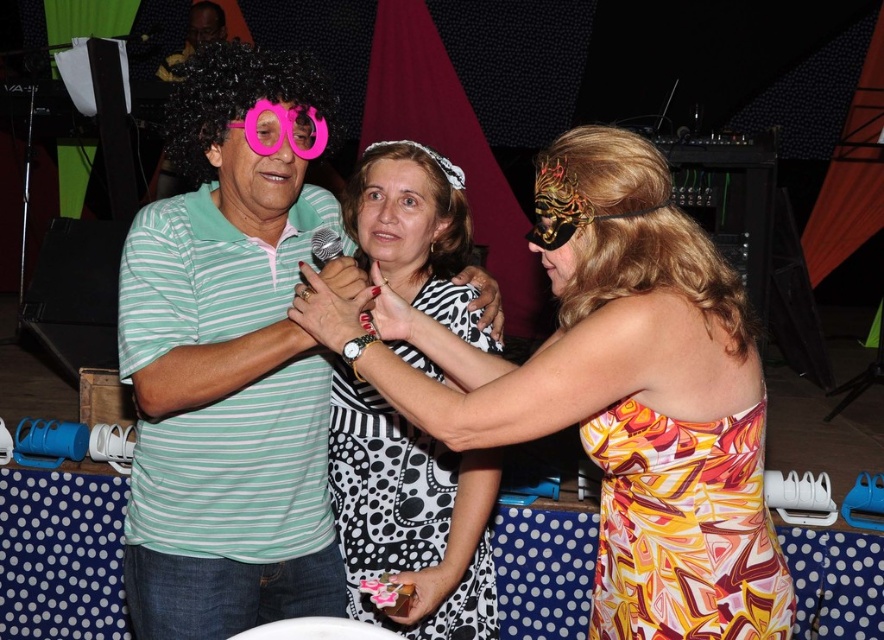
Is point (681, 420) positioned in front of point (442, 168)?

Yes, point (681, 420) is closer to viewer.

I want to click on black and white polka dot dress at center, so click(626, 396).

Locate an element on the screen. Image resolution: width=884 pixels, height=640 pixels. black and white polka dot dress at center is located at coordinates (626, 396).

Where is `gold metallic mask at upper right`? This screenshot has height=640, width=884. gold metallic mask at upper right is located at coordinates (629, 230).

Does gold metallic mask at upper right have a lesser height compared to white fabric wig at center?

No, gold metallic mask at upper right is not shorter than white fabric wig at center.

Between point (661, 236) and point (366, 172), which one is positioned behind?

The point (366, 172) is more distant.

Where is `gold metallic mask at upper right`? gold metallic mask at upper right is located at coordinates (629, 230).

Is gold metallic mask at upper right smaller than black curly wig at center?

Correct, gold metallic mask at upper right occupies less space than black curly wig at center.

Is point (572, 172) positioned after point (178, 168)?

That is False.

I want to click on gold metallic mask at upper right, so click(629, 230).